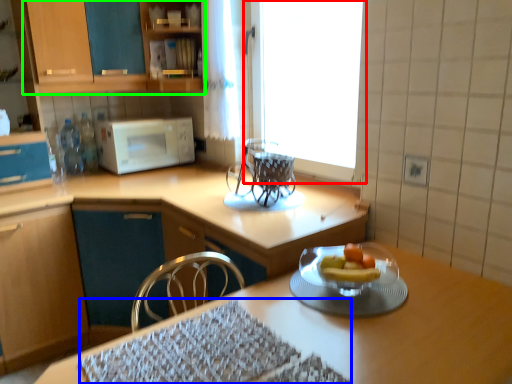
Question: Which object is positioned farthest from window (highlighted by a red box)? Select from place mat (highlighted by a blue box) and cabinetry (highlighted by a green box).

Choices:
 (A) place mat
 (B) cabinetry

Answer: (A)